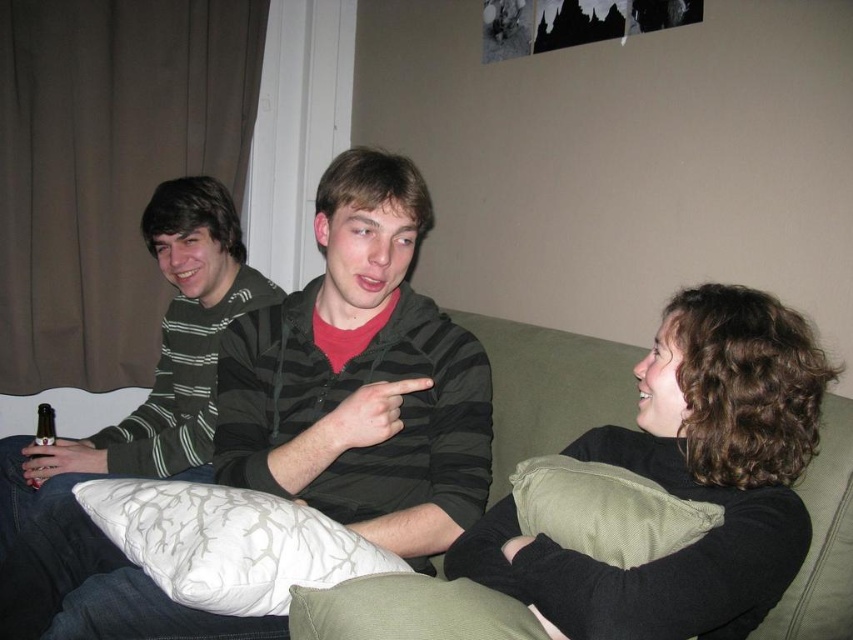
Question: Is dark brown curly hair at right thinner than green fabric couch at center?

Choices:
 (A) no
 (B) yes

Answer: (A)

Question: Among these points, which one is farthest from the camera?

Choices:
 (A) (817, 608)
 (B) (49, 582)
 (C) (41, 426)

Answer: (C)

Question: Which of the following is the closest to the observer?

Choices:
 (A) striped cotton hoodie at center
 (B) matte black can at left

Answer: (A)

Question: Does striped cotton hoodie at center appear under dark brown curly hair at right?

Choices:
 (A) yes
 (B) no

Answer: (B)

Question: Which of the following is the closest to the observer?

Choices:
 (A) (614, 465)
 (B) (38, 429)
 (C) (340, 234)

Answer: (A)

Question: Considering the relative positions of striped hoodie at left and white textured pillow at center in the image provided, where is striped hoodie at left located with respect to white textured pillow at center?

Choices:
 (A) left
 (B) right

Answer: (A)